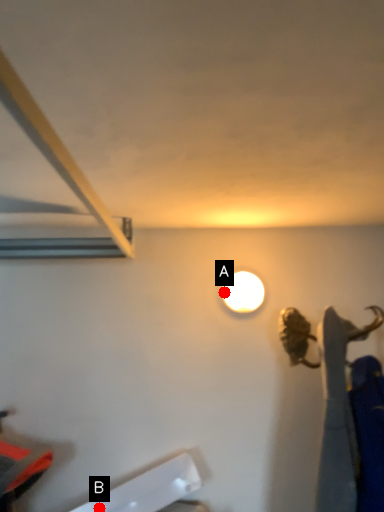
Question: Two points are circled on the image, labeled by A and B beside each circle. Which point appears closest to the camera in this image?

Choices:
 (A) A is closer
 (B) B is closer

Answer: (B)